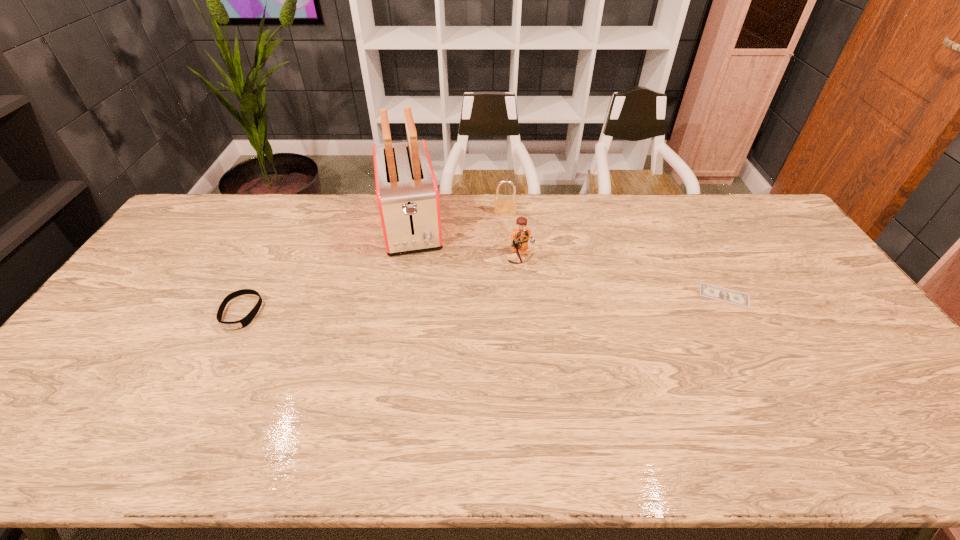
The image size is (960, 540). What are the coordinates of `the second shortest object` in the screenshot? It's located at (245, 321).

Image resolution: width=960 pixels, height=540 pixels. Find the location of `the leftmost object`. the leftmost object is located at coordinates (245, 321).

Locate an element on the screen. The width and height of the screenshot is (960, 540). the shortest object is located at coordinates (709, 291).

This screenshot has height=540, width=960. In order to click on the rightmost object in this screenshot , I will do `click(709, 291)`.

Locate an element on the screen. padlock is located at coordinates (503, 205).

The height and width of the screenshot is (540, 960). In order to click on the fourth object from right to left in this screenshot , I will do `click(407, 194)`.

You are a GUI agent. You are given a task and a screenshot of the screen. Output one action in this format:
    pyautogui.click(x=<x>, y=<y>)
    Task: Click on the toaster
    This screenshot has width=960, height=540.
    Given the screenshot: What is the action you would take?
    pyautogui.click(x=407, y=194)

The width and height of the screenshot is (960, 540). What are the coordinates of `Lego` in the screenshot? It's located at (521, 234).

Find the location of a particular element. This screenshot has height=540, width=960. free spot located 0.060m on the display of the fourth tallest object is located at coordinates (223, 349).

Image resolution: width=960 pixels, height=540 pixels. I want to click on vacant space situated 0.110m on the back of the shortest object, so click(705, 259).